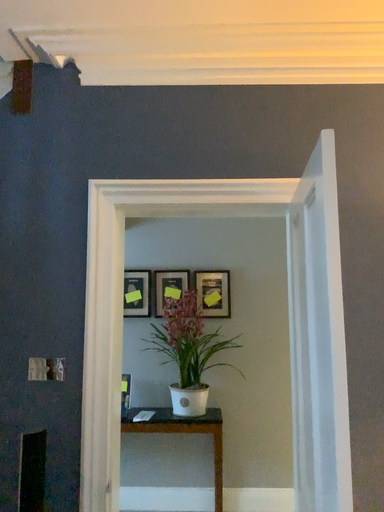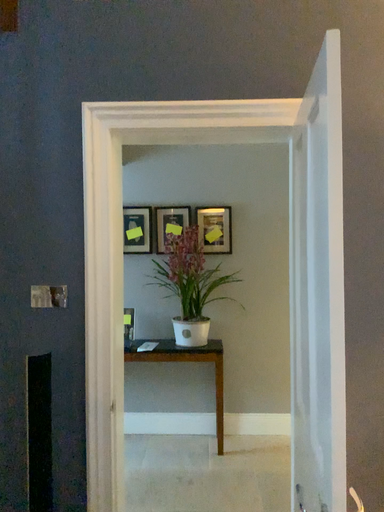
Question: Which way did the camera rotate in the video?

Choices:
 (A) rotated downward
 (B) rotated upward

Answer: (A)